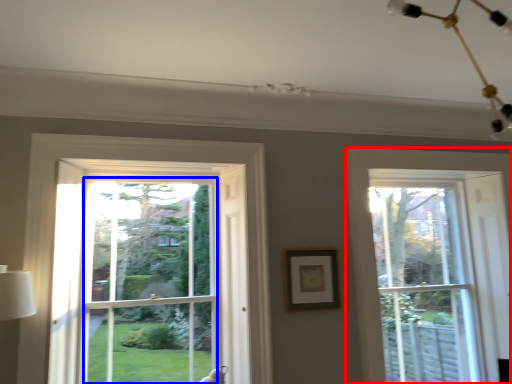
Question: Which object is further to the camera taking this photo, window (highlighted by a red box) or window screen (highlighted by a blue box)?

Choices:
 (A) window
 (B) window screen

Answer: (A)